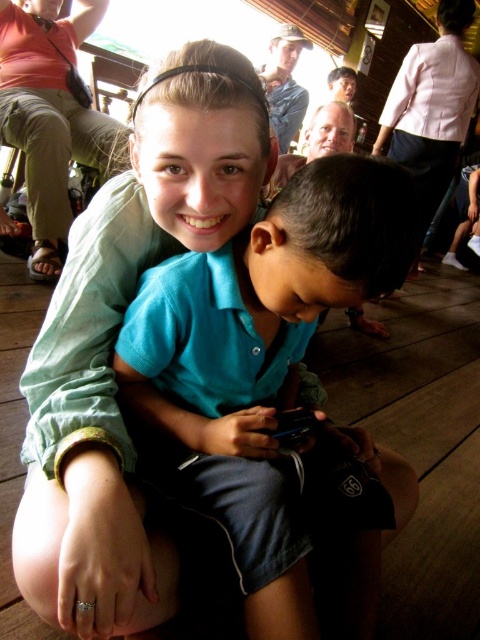
You are at a gathering and want to take a photo of the two people sitting on the wooden floor. The first person is at point (332, 227) and the second is at point (115, 310). To ensure both are in focus, you need to know which point is closer to the camera. Which point is closer?

Point (332, 227) is in front of point (115, 310), so it is closer to the camera.

Based on the photo, you are a photographer trying to capture a group photo of the blue cotton shirt at center and the green cotton shirt at upper center. The camera you are using has a minimum focus distance of 12 centimeters. Can you take a clear photo of both subjects without moving them?

The distance between the blue cotton shirt at center and the green cotton shirt at upper center is 13.38 centimeters, which is greater than the camera minimum focus distance of 12 centimeters. Therefore, you can take a clear photo of both subjects without moving them.

You are at a social gathering and want to take a photo of the blue cotton shirt at center and the green cotton shirt at upper center. Which one should you focus on first to capture both in the frame?

The blue cotton shirt at center is below the green cotton shirt at upper center, so you should focus on the green cotton shirt at upper center first to ensure both are in the frame.